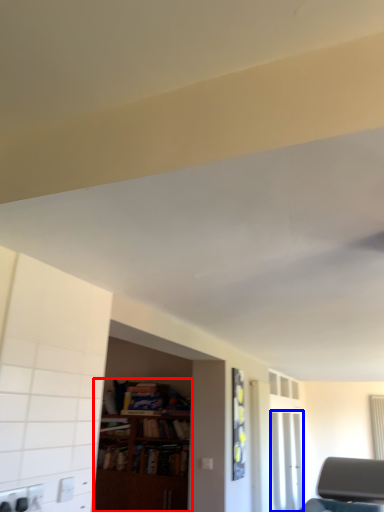
Question: Which of the following is the farthest to the observer, bookcase (highlighted by a red box) or glass door (highlighted by a blue box)?

Choices:
 (A) bookcase
 (B) glass door

Answer: (B)